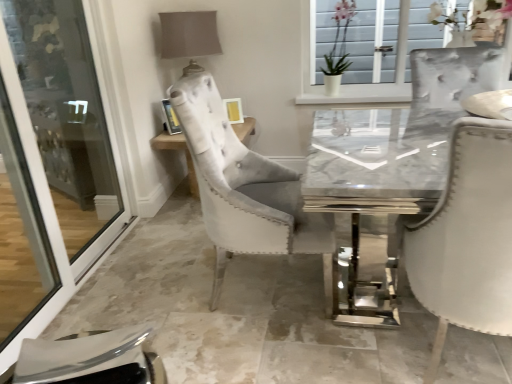
This screenshot has width=512, height=384. In order to click on vacant space underneath transparent glass screen door at left (from a real-world perspective) in this screenshot , I will do `click(93, 267)`.